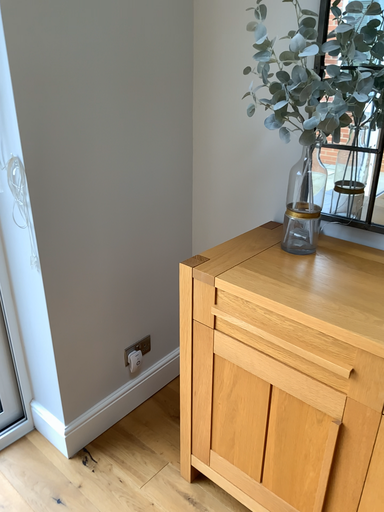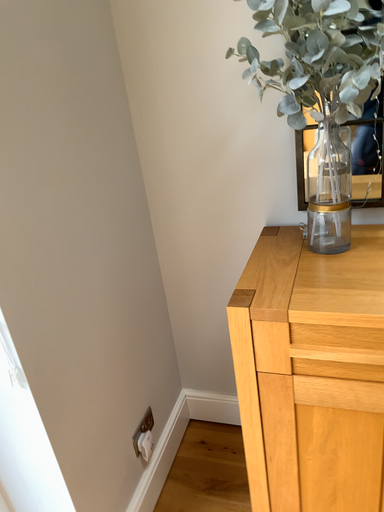
Question: Which way did the camera rotate in the video?

Choices:
 (A) rotated right
 (B) rotated left

Answer: (A)